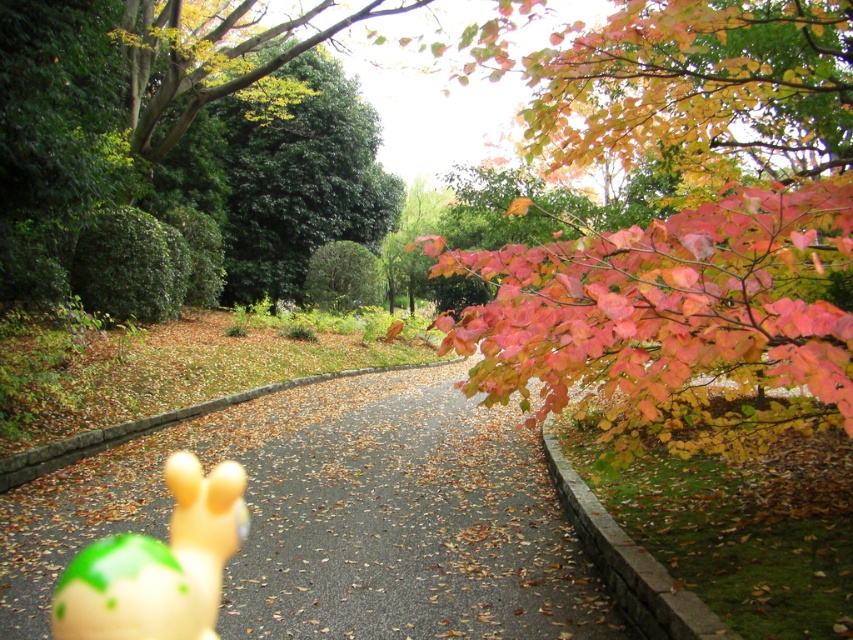
Question: Which point is closer to the camera taking this photo?

Choices:
 (A) (234, 618)
 (B) (692, 368)

Answer: (B)

Question: Which point is farther to the camera?

Choices:
 (A) shiny red leaves at upper right
 (B) smooth asphalt road at center

Answer: (B)

Question: Does smooth asphalt road at center come behind translucent yellow toy at center?

Choices:
 (A) yes
 (B) no

Answer: (A)

Question: Among these points, which one is farthest from the camera?

Choices:
 (A) (152, 557)
 (B) (788, 212)
 (C) (245, 552)

Answer: (C)

Question: Where is shiny red leaves at upper right located in relation to translucent yellow toy at center in the image?

Choices:
 (A) left
 (B) right

Answer: (B)

Question: Is smooth asphalt road at center above translucent yellow toy at center?

Choices:
 (A) yes
 (B) no

Answer: (A)